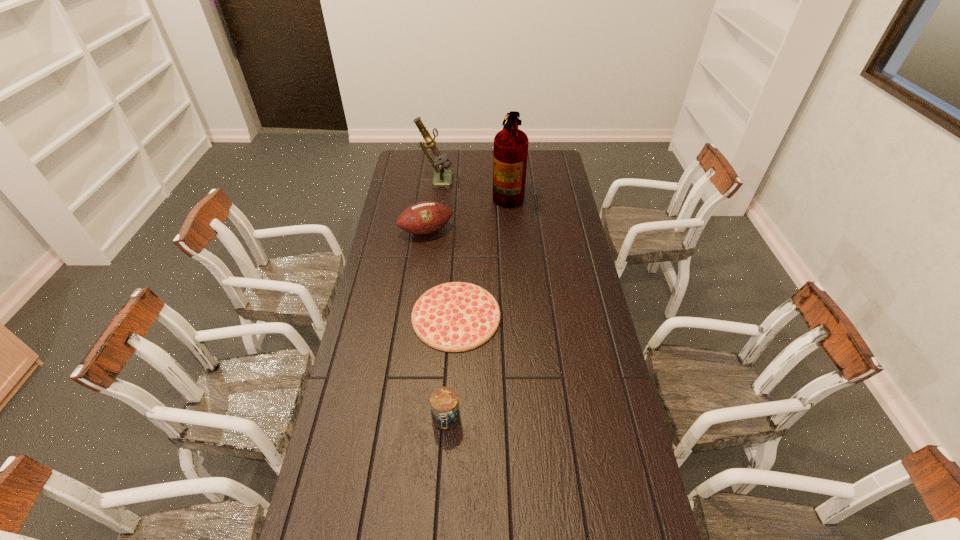
At what (x,y) coordinates should I click in order to perform the action: click on fire extinguisher. Please return your answer as a coordinate pair (x, y). Image resolution: width=960 pixels, height=540 pixels. Looking at the image, I should click on (510, 155).

Where is `microscope`? Image resolution: width=960 pixels, height=540 pixels. microscope is located at coordinates (442, 178).

Where is `the third nearest object`? the third nearest object is located at coordinates click(x=422, y=218).

Find the location of `football (American)`. football (American) is located at coordinates (422, 218).

Identify the location of jar. (444, 405).

The height and width of the screenshot is (540, 960). I want to click on the nearest object, so click(x=444, y=405).

The height and width of the screenshot is (540, 960). What are the coordinates of `pizza` in the screenshot? It's located at (457, 316).

Locate an element on the screen. The width and height of the screenshot is (960, 540). the shortest object is located at coordinates (457, 316).

Where is `vacant region located 0.220m at the nozzle of the tallest object`? vacant region located 0.220m at the nozzle of the tallest object is located at coordinates (448, 193).

At what (x,y) coordinates should I click in order to perform the action: click on free location located at the nozzle of the tallest object. Please return your answer as a coordinate pair (x, y). Looking at the image, I should click on (454, 193).